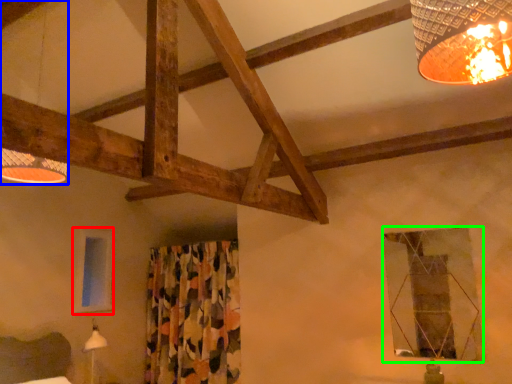
Question: Which object is the farthest from window (highlighted by a red box)? Choose among these: lamp (highlighted by a blue box) or window (highlighted by a green box).

Choices:
 (A) lamp
 (B) window

Answer: (B)